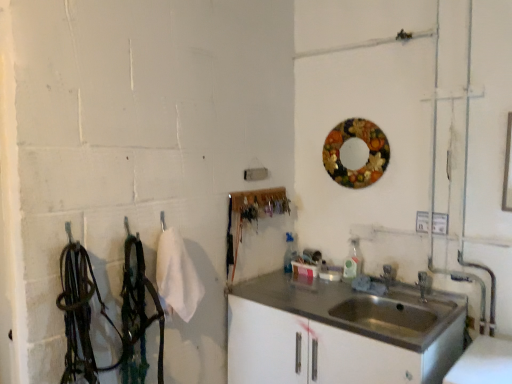
Identify the location of vacant area that lies in front of satin silver faucet at sink right. The image size is (512, 384). (393, 303).